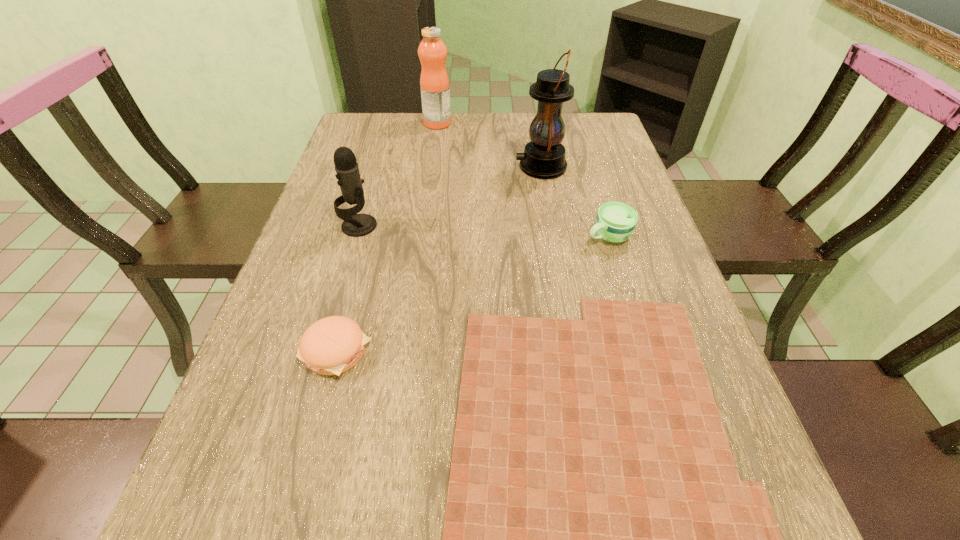
This screenshot has width=960, height=540. Identify the location of the second farthest object. (544, 156).

The width and height of the screenshot is (960, 540). In order to click on the fourth object from right to left in this screenshot , I will do click(434, 83).

At what (x,y) coordinates should I click in order to perform the action: click on fruit juice. Please return your answer as a coordinate pair (x, y). Looking at the image, I should click on (434, 83).

Locate an element on the screen. This screenshot has width=960, height=540. microphone is located at coordinates (347, 169).

The width and height of the screenshot is (960, 540). Find the location of `cup`. cup is located at coordinates (615, 222).

Locate an element on the screen. the second shortest object is located at coordinates (330, 346).

Locate several spots within vacant area situated above the fifth nearest object, indicating its light source. Please provide its 2D coordinates. Your answer should be formatted as a tuple, i.e. [(x, y)], where the tuple contains the x and y coordinates of a point satisfying the conditions above.

[(488, 167)]

Can you find a vacant point located above the fifth nearest object, indicating its light source? Please provide its 2D coordinates. Your answer should be formatted as a tuple, i.e. [(x, y)], where the tuple contains the x and y coordinates of a point satisfying the conditions above.

[(433, 167)]

Locate several spots in the free space located 0.250m above the fifth nearest object, indicating its light source. Please provide its 2D coordinates. Your answer should be formatted as a tuple, i.e. [(x, y)], where the tuple contains the x and y coordinates of a point satisfying the conditions above.

[(429, 167)]

The height and width of the screenshot is (540, 960). Identify the location of free spot located 0.090m on the left of the fruit juice. (396, 124).